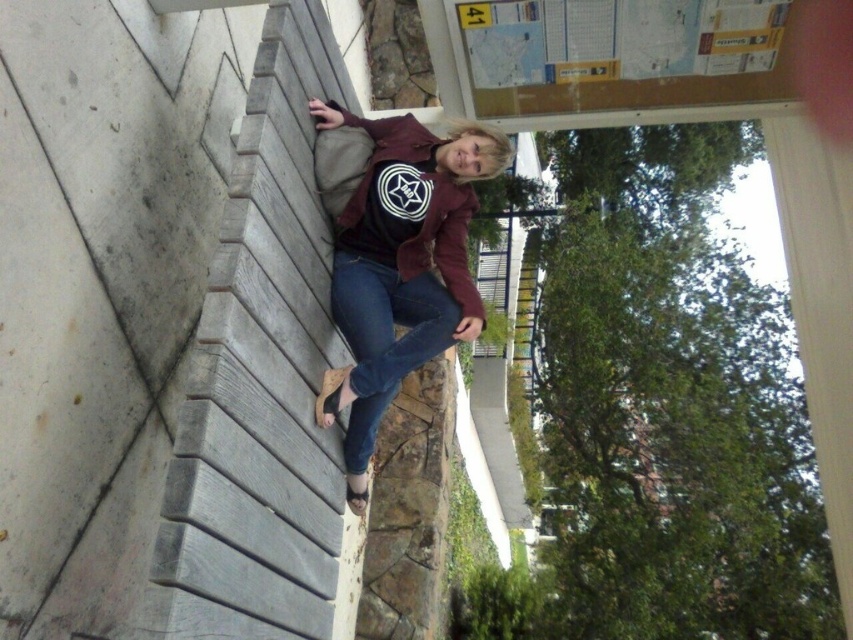
Question: Does denim at left appear on the right side of matte maroon sweatshirt at center?

Choices:
 (A) no
 (B) yes

Answer: (A)

Question: Among these objects, which one is nearest to the camera?

Choices:
 (A) matte brown jacket at center
 (B) wooden corkboard at upper right
 (C) matte maroon sweatshirt at center
 (D) denim at left

Answer: (A)

Question: Which point is farther to the camera?

Choices:
 (A) (373, 134)
 (B) (354, 449)
 (C) (408, 120)

Answer: (C)

Question: Does denim at left have a lesser width compared to matte maroon sweatshirt at center?

Choices:
 (A) no
 (B) yes

Answer: (B)

Question: Which point is closer to the camera?

Choices:
 (A) wooden corkboard at upper right
 (B) matte brown jacket at center
 (C) matte maroon sweatshirt at center
 (D) denim at left

Answer: (B)

Question: Is wooden corkboard at upper right to the left of matte maroon sweatshirt at center from the viewer's perspective?

Choices:
 (A) yes
 (B) no

Answer: (B)